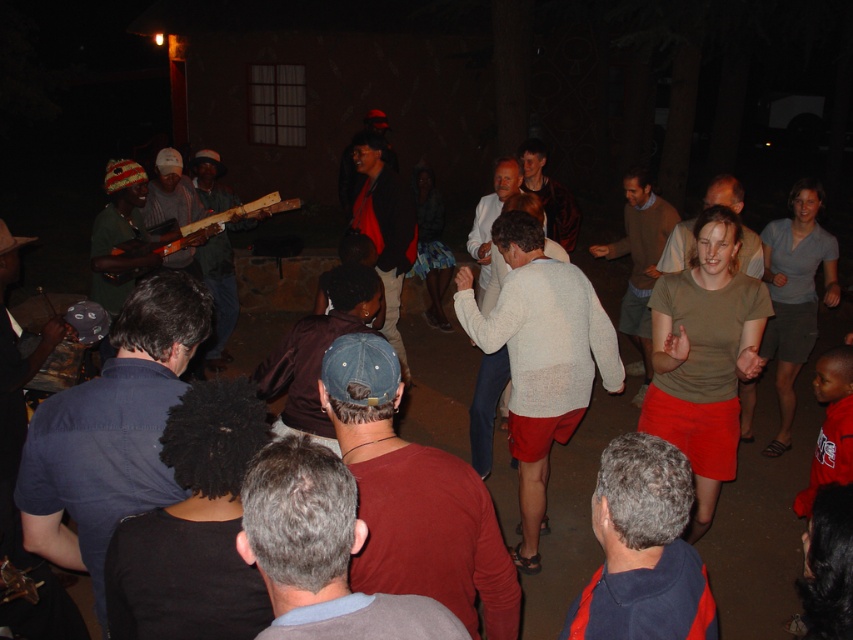
Can you confirm if dark red sweater at center is positioned above gray hair at center?

Correct, dark red sweater at center is located above gray hair at center.

Is dark red sweater at center shorter than gray hair at center?

No, dark red sweater at center is not shorter than gray hair at center.

Between point (399, 384) and point (675, 449), which one is positioned behind?

Positioned behind is point (399, 384).

Where is `dark red sweater at center`? This screenshot has height=640, width=853. dark red sweater at center is located at coordinates (415, 499).

Image resolution: width=853 pixels, height=640 pixels. What do you see at coordinates (384, 227) in the screenshot? I see `matte black jacket at center` at bounding box center [384, 227].

Does matte black jacket at center appear under white sweater at center?

Incorrect, matte black jacket at center is not positioned below white sweater at center.

Between point (375, 136) and point (483, 241), which one is positioned in front?

Point (483, 241) is in front.

In order to click on matte black jacket at center in this screenshot , I will do `click(384, 227)`.

The width and height of the screenshot is (853, 640). Identify the location of brown leather jacket at center. (317, 349).

Is point (318, 436) farther from viewer compared to point (395, 294)?

No.

Locate an element on the screen. The width and height of the screenshot is (853, 640). brown leather jacket at center is located at coordinates (317, 349).